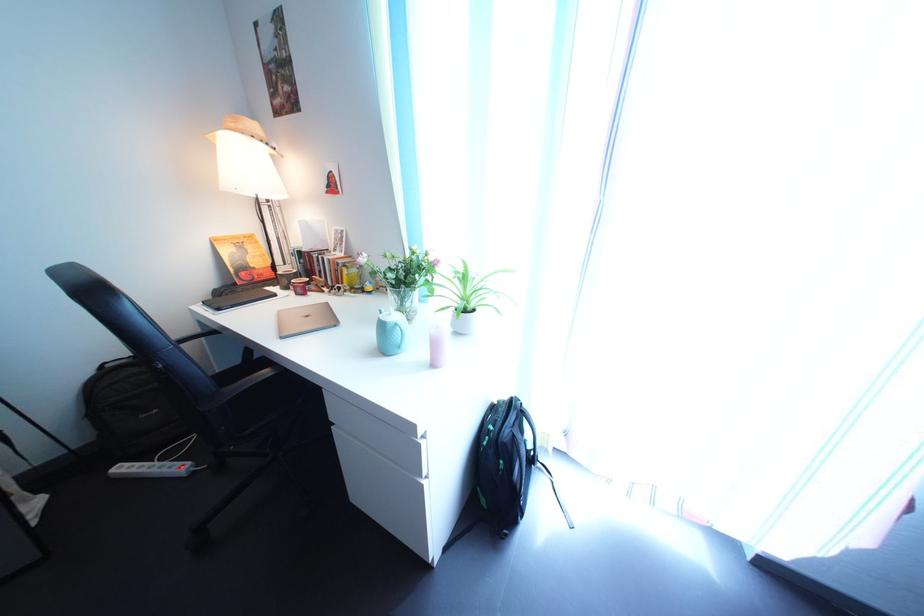
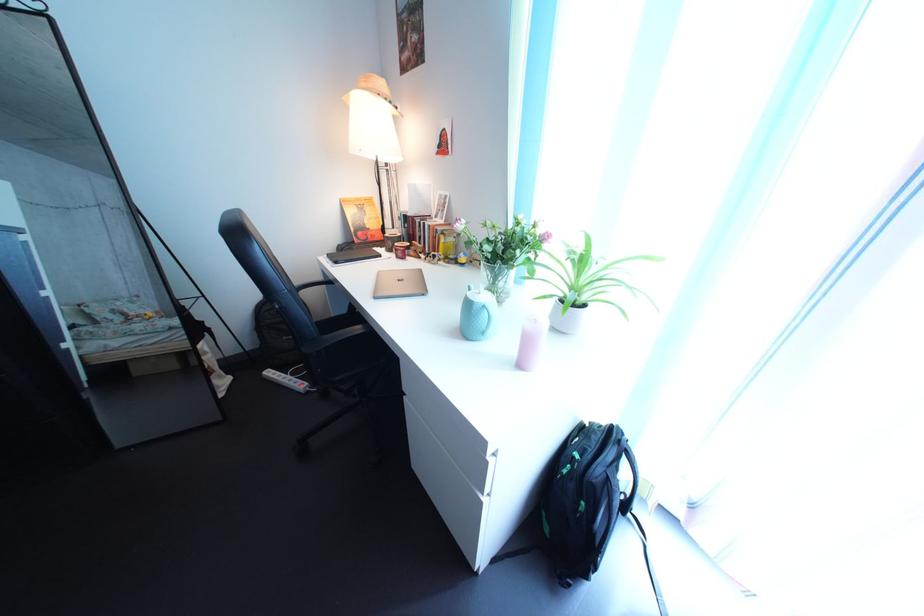
Find the pixel in the second image that matches (x=300, y=307) in the first image.

(402, 269)